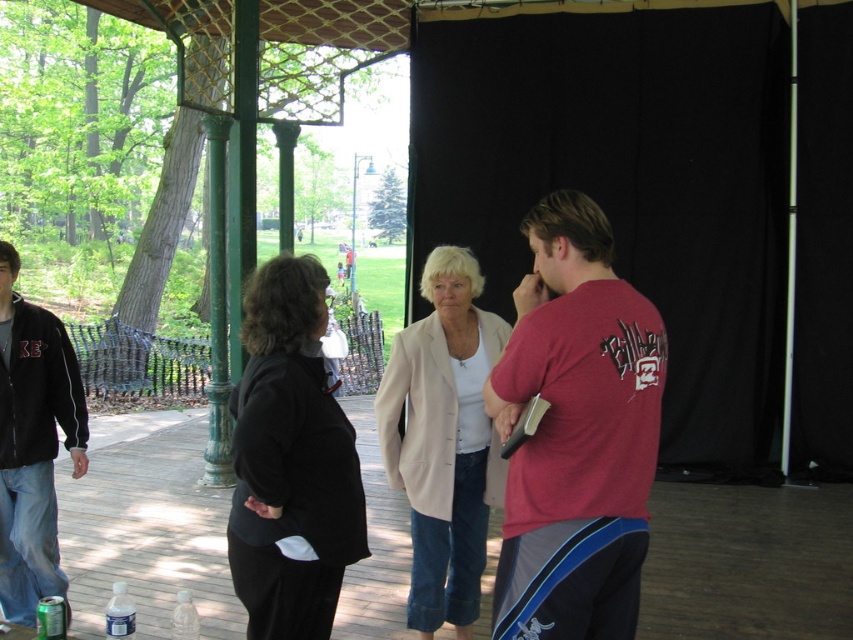
You are standing at the entrance of the wooden pavilion and want to greet both the person wearing the light beige fabric jacket at center and the person in the black fleece jacket at left. If you walk straight ahead, will you reach both individuals before covering 5 feet?

The light beige fabric jacket at center is 4.94 feet away from the black fleece jacket at left. Since the distance between them is less than 5 feet, walking straight ahead will allow you to reach both individuals within the 5 feet distance.

You are standing at the entrance of the wooden pavilion and want to walk to the point that is closer to you. Which point should you head towards, point (445, 396) or point (71, 378)?

You should head towards point (445, 396) because it is closer to the viewer than point (71, 378).

Which object is located at the coordinates point (576,433)?

The object at point (576,433) is the matte red tshirt at right.